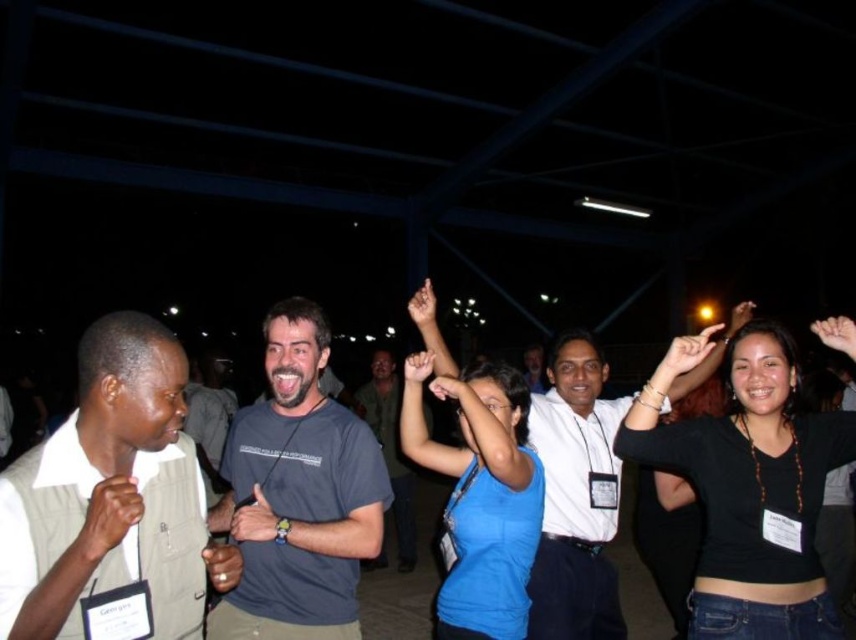
Question: Is matte black hand at upper right smaller than matte black hand at center?

Choices:
 (A) no
 (B) yes

Answer: (A)

Question: Considering the real-world distances, which object is farthest from the matte black hand at upper center?

Choices:
 (A) light brown fabric shirt at left
 (B) dark skin hand at center
 (C) matte gray wristwatch at center

Answer: (B)

Question: From the image, what is the correct spatial relationship of gray cotton t-shirt at center in relation to white shirt at center?

Choices:
 (A) below
 (B) above

Answer: (A)

Question: Which point is closer to the camera?

Choices:
 (A) (99, 552)
 (B) (672, 346)

Answer: (A)

Question: Which point is farther to the camera?

Choices:
 (A) (685, 356)
 (B) (403, 548)
 (C) (431, 292)
 (D) (851, 321)

Answer: (B)

Question: Can you confirm if white shirt at center is positioned to the right of smooth skin hand at upper right?

Choices:
 (A) yes
 (B) no

Answer: (B)